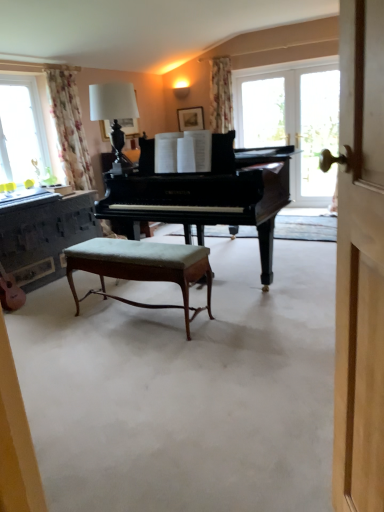
Question: Considering the positions of wooden stool at center and shiny black piano at center in the image, is wooden stool at center wider or thinner than shiny black piano at center?

Choices:
 (A) thin
 (B) wide

Answer: (B)

Question: From a real-world perspective, relative to shiny black piano at center, is wooden stool at center vertically above or below?

Choices:
 (A) below
 (B) above

Answer: (A)

Question: Which object is positioned closest to the shiny black piano at center?

Choices:
 (A) wooden picture frame at upper center
 (B) transparent glass door at right
 (C) green fabric stool at center
 (D) wooden dresser at left
 (E) floral fabric curtain at left

Answer: (C)

Question: Which is farther from the wooden picture frame at upper center?

Choices:
 (A) wooden stool at center
 (B) green fabric stool at center
 (C) transparent glass door at right
 (D) floral fabric curtain at left
 (E) shiny black piano at center

Answer: (A)